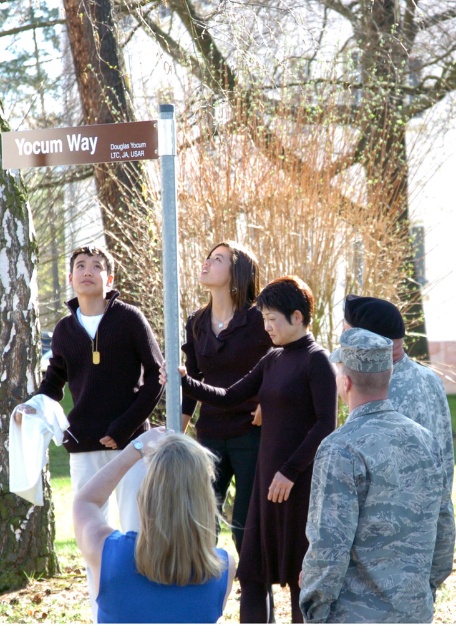
Between bark textured tree at left and silver metallic pole at center, which one appears on the right side from the viewer's perspective?

silver metallic pole at center

Which is behind, point (25, 256) or point (160, 150)?

The point (25, 256) is more distant.

Between point (5, 451) and point (162, 209), which one is positioned in front?

Point (162, 209)

Image resolution: width=456 pixels, height=640 pixels. Identify the location of bark textured tree at left. (19, 385).

Measure the distance between point (398, 477) and camera.

A distance of 18.42 feet exists between point (398, 477) and camera.

Which is in front, point (357, 612) or point (86, 470)?

Point (357, 612) is more forward.

The width and height of the screenshot is (456, 640). Identify the location of camouflage uniform at right. (373, 502).

Is point (316, 387) closer to camera compared to point (224, 564)?

No, it is behind (224, 564).

Does camouflage fabric uniform at center come in front of camouflage fabric uniform at lower center?

No, it is not.

Describe the element at coordinates (279, 461) in the screenshot. I see `camouflage fabric uniform at center` at that location.

Find the location of `camouflage fabric uniform at center`. camouflage fabric uniform at center is located at coordinates pyautogui.click(x=279, y=461).